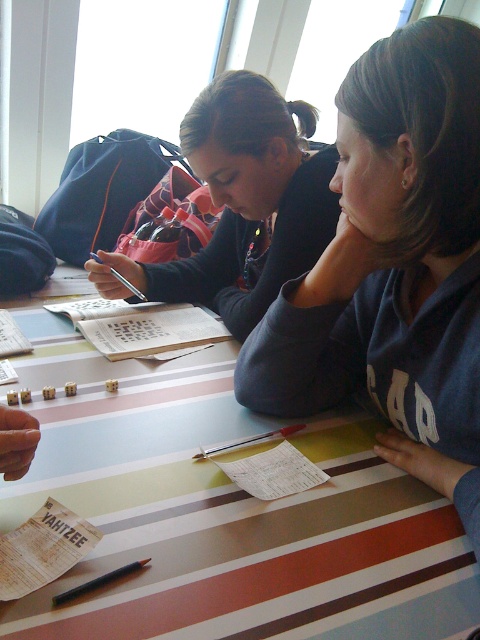
You are a guest at this table and need to place a small gift on the table without covering any of the striped paper at center or the dark gray sweatshirt at center. Where should you put it?

The striped paper at center is larger in size than the dark gray sweatshirt at center, so you should place the small gift on the remaining space of the striped paper at center that is not covered by the dark gray sweatshirt at center.